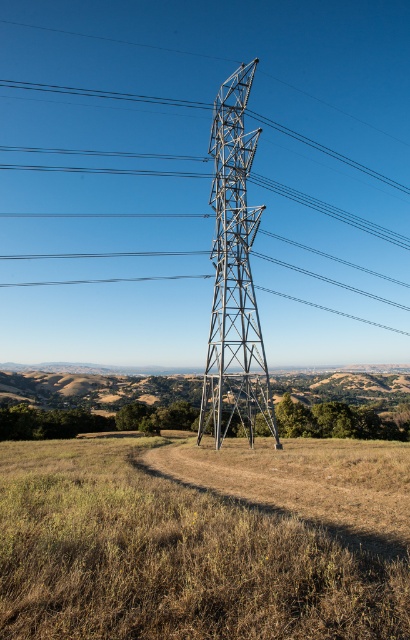
You are a drone operator planning to fly a drone with a 1.2 meter wingspan between the brown dry grass at center and the metallic gray tower at center. Based on the scene, can the drone safely pass through the space between them?

The brown dry grass at center might be wider than metallic gray tower at center, so the space between them could be sufficient for the drone with a 1.2 meter wingspan to pass safely.

You are a hiker trying to reach the base of the metallic gray tower at center. From your current position at the edge of the brown dry grass at center, can you see the entire height of the tower without any obstruction?

The brown dry grass at center is shorter than the metallic gray tower at center, so yes, you can see the entire height of the metallic gray tower at center without any obstruction from the brown dry grass at center.